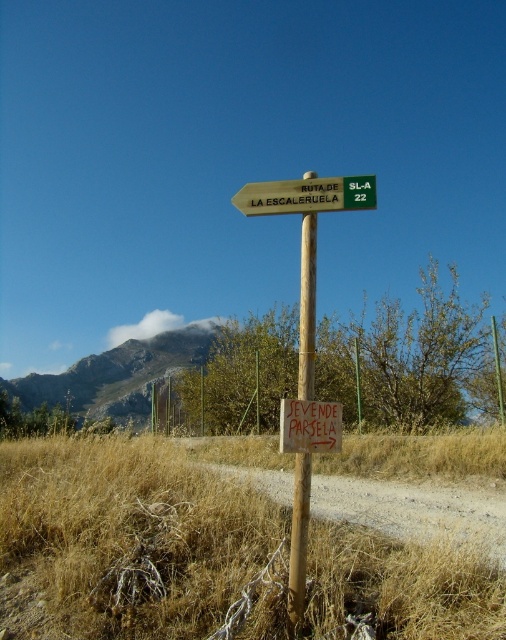
You are standing at the signpost and want to take the path that leads to the right as indicated by the main sign. Which direction should you turn to follow the brown dirt track at center relative to the green plastic signpost at center?

The brown dirt track at center is to the right of the green plastic signpost at center, so you should turn right to follow it.

You are a hiker carrying a 1.5 meter wide tent. You need to set up camp along the brown dirt track at center. However, there is a green plastic signpost at center nearby. Will the signpost block the width of the track, making it impossible to set up your tent there?

The brown dirt track at center might be wider than green plastic signpost at center, so it is possible that the track is wide enough to accommodate the tent without obstruction from the signpost. However, since the exact width difference isn

You are a hiker who wants to ensure your backpack won t get caught on any obstacles while passing by the dry straw at lower center and the green plastic signpost at center. Which object should you be more cautious of due to its width?

The dry straw at lower center might be wider than green plastic signpost at center, so you should be more cautious of the dry straw at lower center when passing by to avoid your backpack getting caught.